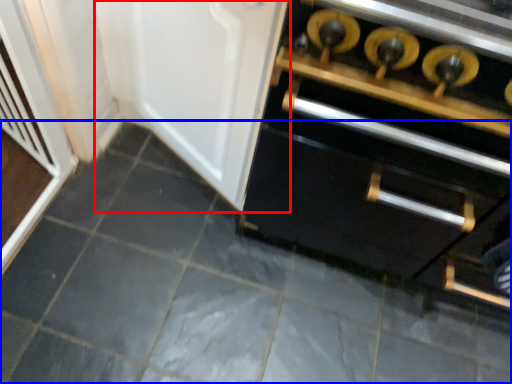
Question: Among these objects, which one is nearest to the camera, door (highlighted by a red box) or ceramic tile (highlighted by a blue box)?

Choices:
 (A) door
 (B) ceramic tile

Answer: (A)